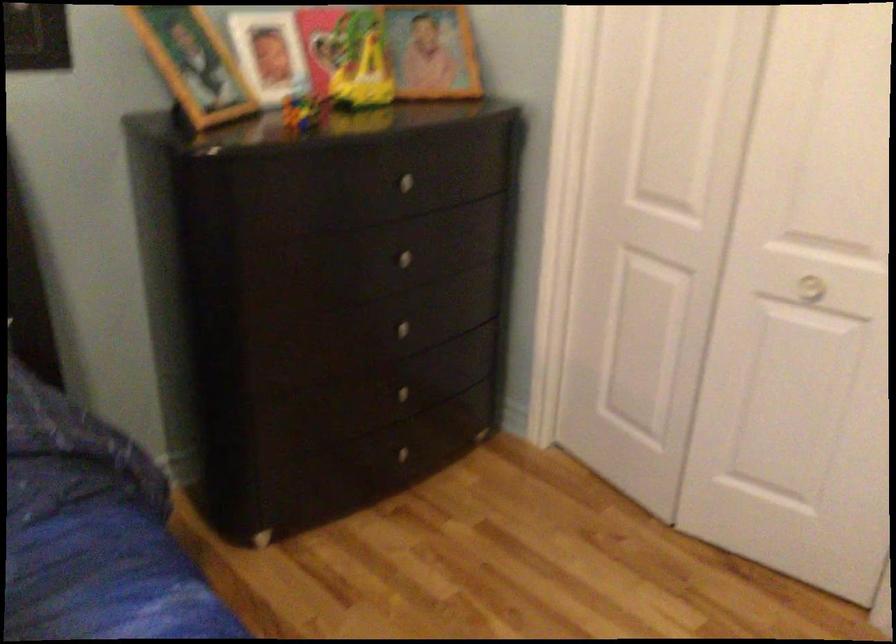
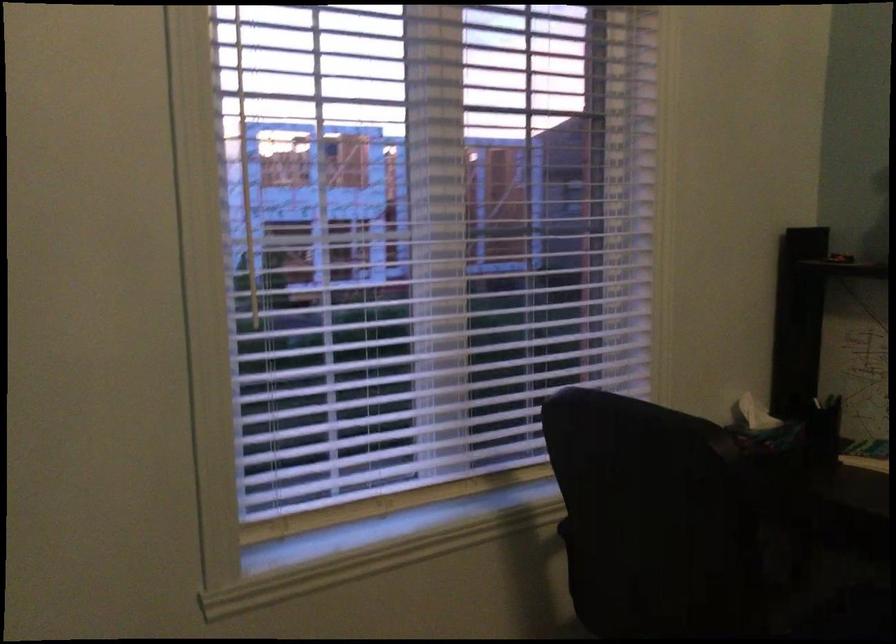
Question: How did the camera likely rotate?

Choices:
 (A) Left
 (B) Right
 (C) Up
 (D) Down

Answer: (A)